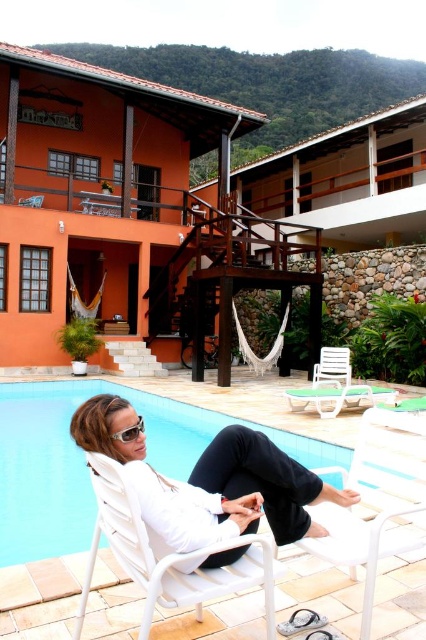
You are trying to place the matte white sunglasses at lower center on the white plastic chair at lower right. Based on their sizes, will the sunglasses fit on the chair?

The white plastic chair at lower right is bigger than the matte white sunglasses at lower center, so the sunglasses will fit on the chair.

You are standing at the edge of the pool and want to walk to the point marked as point (385, 484). There is an obstacle at point (135, 429). Will you encounter the obstacle before reaching your destination?

Point (385, 484) is further to the camera than point (135, 429), so you will encounter the obstacle at point (135, 429) before reaching your destination.